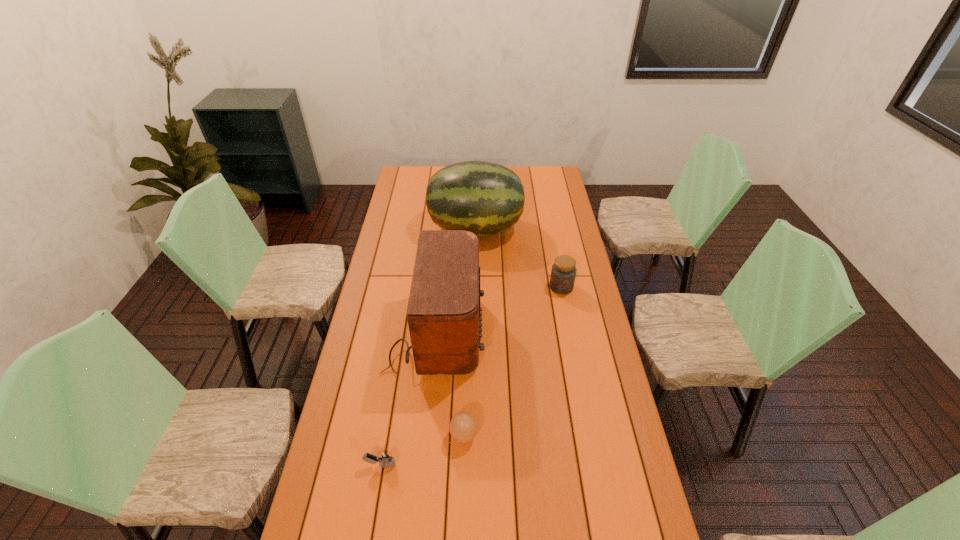
In order to click on vacant space located on the surface of the rightmost object near the warning symbol in this screenshot , I will do `click(569, 329)`.

Find the location of a particular element. This screenshot has width=960, height=540. free space located 0.310m on the right of the boiled egg is located at coordinates (578, 436).

Where is `vacant space positioned 0.300m on the back of the shortest object`? The width and height of the screenshot is (960, 540). vacant space positioned 0.300m on the back of the shortest object is located at coordinates (396, 373).

Where is `radio receiver at the left edge`? The width and height of the screenshot is (960, 540). radio receiver at the left edge is located at coordinates (444, 319).

Identify the location of igniter situated at the left edge. (386, 460).

At what (x,y) coordinates should I click in order to perform the action: click on object at the right edge. Please return your answer as a coordinate pair (x, y). This screenshot has height=540, width=960. Looking at the image, I should click on (563, 273).

Locate an element on the screen. This screenshot has width=960, height=540. vacant space at the far edge of the desktop is located at coordinates (435, 166).

In the image, there is a desktop. Where is `free region at the left edge`? The image size is (960, 540). free region at the left edge is located at coordinates (403, 313).

You are a GUI agent. You are given a task and a screenshot of the screen. Output one action in this format:
    pyautogui.click(x=<x>, y=<y>)
    Task: Click on the free spot at the right edge of the desktop
    The width and height of the screenshot is (960, 540).
    Given the screenshot: What is the action you would take?
    pyautogui.click(x=576, y=351)

I want to click on vacant region at the far left corner of the desktop, so click(x=406, y=168).